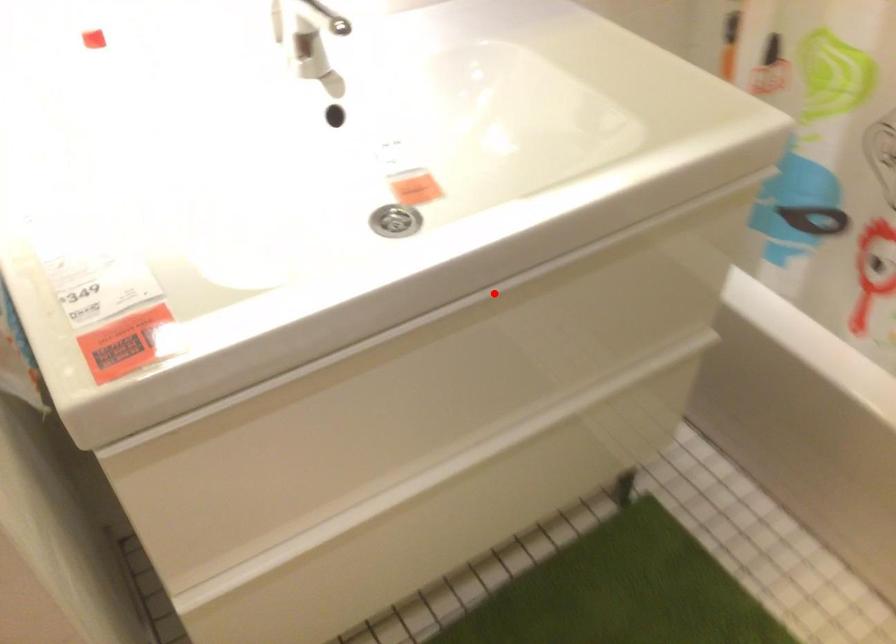
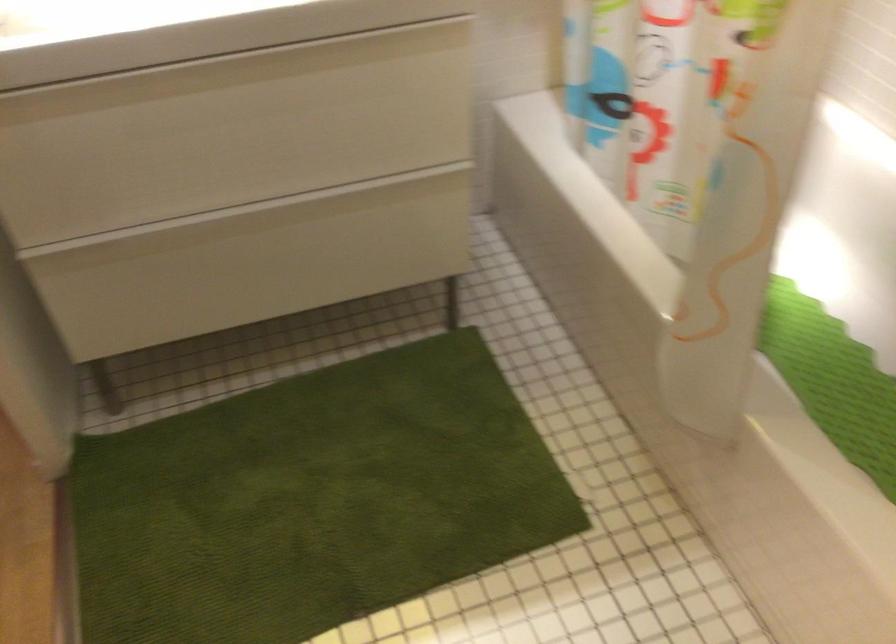
Question: I am providing you with two images of the same scene from different viewpoints. Image1 has a red point marked. In image2, the corresponding 3D location appears at what relative position? Reply with the corresponding letter.

Choices:
 (A) Closer
 (B) Farther

Answer: (B)